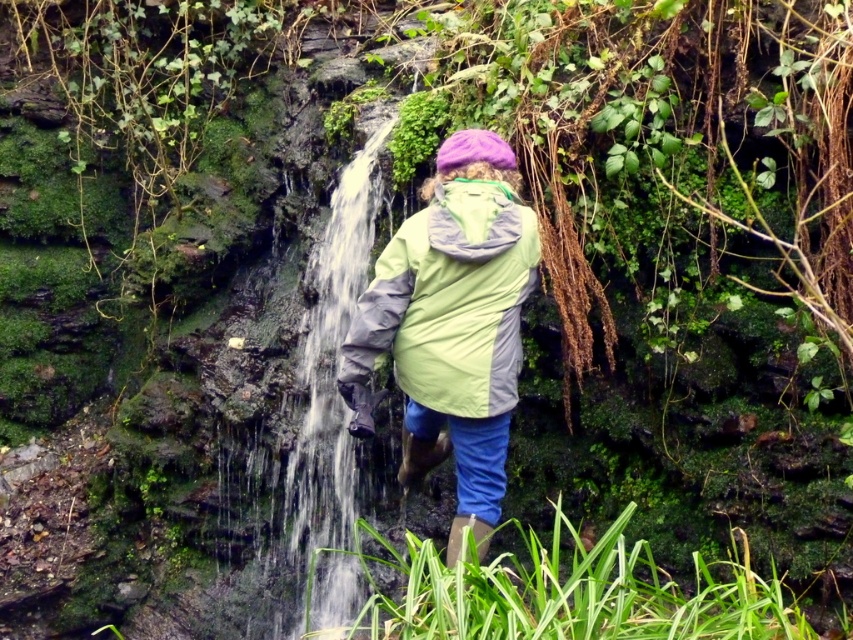
You are a hiker who wants to cross a small stream near the waterfall. You see the green leafy grass at lower center and the green fabric jacket at center. Which object is shorter in height?

The green leafy grass at lower center is not as tall as the green fabric jacket at center, so the green leafy grass at lower center is shorter in height.

You are standing at the edge of the scene and want to step onto the green leafy grass at lower center. Is the clear water at center between you and the grass?

The green leafy grass at lower center is below clear water at center, so yes, the clear water at center is between you and the grass.